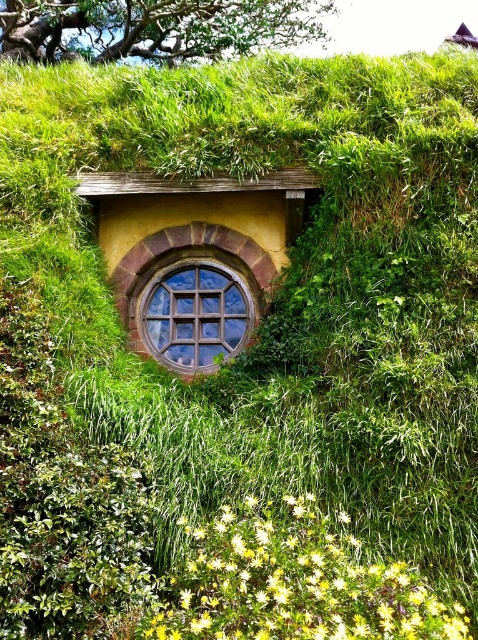
Which is more to the right, green leafy hedge at lower left or wooden window at center?

wooden window at center

Looking at this image, is green leafy hedge at lower left thinner than wooden window at center?

Yes.

Does point (117, 636) lie in front of point (178, 180)?

That is True.

Image resolution: width=478 pixels, height=640 pixels. I want to click on green leafy hedge at lower left, so click(61, 500).

Is yellow matte flower at lower center further to the viewer compared to wooden grid window at center?

No, it is in front of wooden grid window at center.

Can you confirm if yellow matte flower at lower center is positioned above wooden grid window at center?

Actually, yellow matte flower at lower center is below wooden grid window at center.

Is point (317, 564) more distant than point (160, 268)?

No, (317, 564) is in front of (160, 268).

I want to click on yellow matte flower at lower center, so click(x=293, y=584).

Is point (391, 573) positioned behind point (140, 253)?

No, it is not.

Can you confirm if yellow matte flower at lower center is bigger than wooden window at center?

No, yellow matte flower at lower center is not bigger than wooden window at center.

Identify the location of yellow matte flower at lower center. (293, 584).

The width and height of the screenshot is (478, 640). I want to click on yellow matte flower at lower center, so click(x=293, y=584).